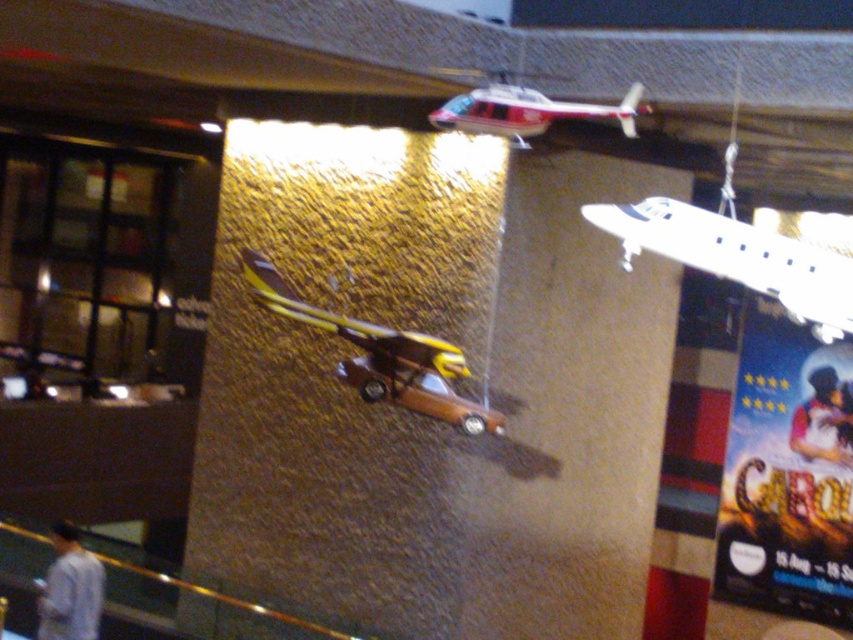
You are an architect designing a new building and want to place a model airplane in the same position as the one in the image. What are the coordinates for placing the white matte airplane at upper right?

The white matte airplane at upper right should be placed at coordinates point (x=735, y=257).

You are an art curator planning to install a new exhibit. You have a blue glossy poster at upper right and a yellow matte airplane at center. Based on their positions, which object is closer to the right edge of the wall?

The blue glossy poster at upper right is closer to the right edge of the wall because it is positioned to the right of the yellow matte airplane at center.

You are standing in front of the textured wall and see two points marked in the image. Which point is closer to you, point (822,589) or point (614,113)?

Point (822,589) is further to the camera than point (614,113), so the closer point to you is point (614,113).